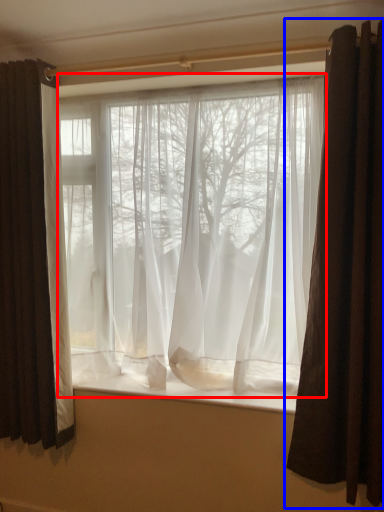
Question: Which object is closer to the camera taking this photo, curtain (highlighted by a red box) or curtain (highlighted by a blue box)?

Choices:
 (A) curtain
 (B) curtain

Answer: (B)